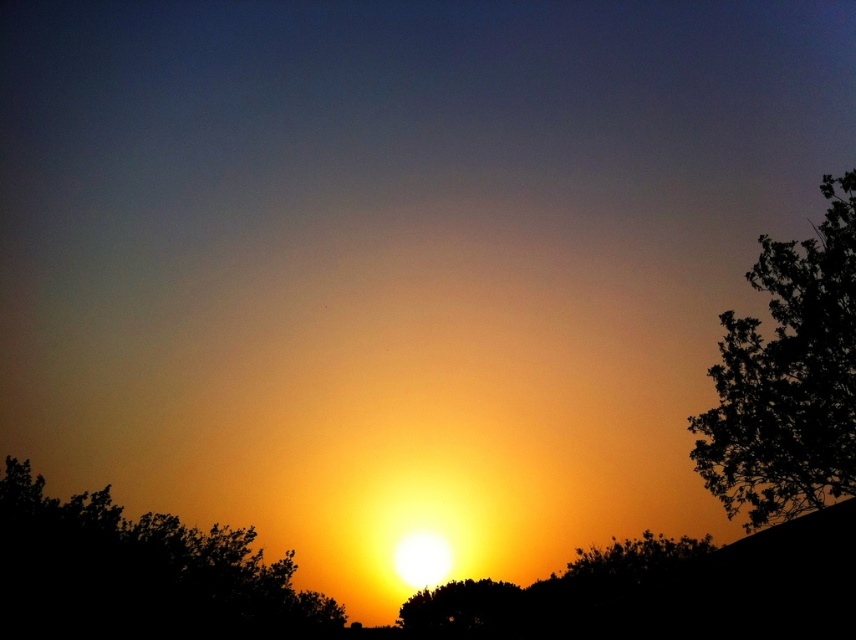
Is silhouette leafy tree at center bigger than green leafy tree at center?

Yes, silhouette leafy tree at center is bigger than green leafy tree at center.

Between silhouette leafy tree at center and green leafy tree at center, which one has more height?

Standing taller between the two is silhouette leafy tree at center.

What do you see at coordinates (140, 570) in the screenshot? I see `silhouette leafy tree at center` at bounding box center [140, 570].

What are the coordinates of `silhouette leafy tree at center` in the screenshot? It's located at (140, 570).

Is green leafy tree at center bigger than silhouette leafy tree at lower right?

No, green leafy tree at center is not bigger than silhouette leafy tree at lower right.

Does green leafy tree at center appear on the left side of silhouette leafy tree at lower right?

Yes, green leafy tree at center is to the left of silhouette leafy tree at lower right.

Find the location of a particular element. This screenshot has height=640, width=856. green leafy tree at center is located at coordinates (462, 609).

Does dark green leafy tree at right have a smaller size compared to silhouette leafy tree at center?

No, dark green leafy tree at right is not smaller than silhouette leafy tree at center.

Image resolution: width=856 pixels, height=640 pixels. Identify the location of dark green leafy tree at right. (788, 378).

Does point (785, 424) come closer to viewer compared to point (108, 584)?

Yes, point (785, 424) is closer to viewer.

At what (x,y) coordinates should I click in order to perform the action: click on dark green leafy tree at right. Please return your answer as a coordinate pair (x, y). The width and height of the screenshot is (856, 640). Looking at the image, I should click on (788, 378).